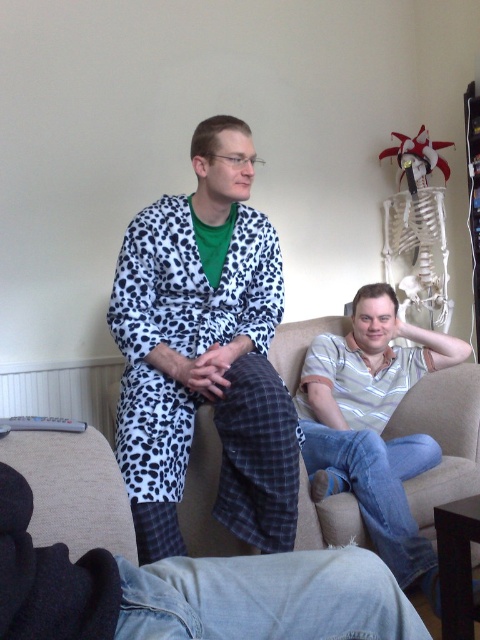
Who is positioned more to the left, white leopard print robe at left or denim pants at lower center?

Positioned to the left is white leopard print robe at left.

Between white leopard print robe at left and denim pants at lower center, which one appears on the right side from the viewer's perspective?

denim pants at lower center

At what (x,y) coordinates should I click in order to perform the action: click on white leopard print robe at left. Please return your answer as a coordinate pair (x, y). Image resolution: width=480 pixels, height=640 pixels. Looking at the image, I should click on (194, 392).

You are a GUI agent. You are given a task and a screenshot of the screen. Output one action in this format:
    pyautogui.click(x=<x>, y=<y>)
    Task: Click on the white leopard print robe at left
    
    Given the screenshot: What is the action you would take?
    pyautogui.click(x=194, y=392)

Does denim pants at lower center have a larger size compared to striped cotton shirt at center?

No.

At what (x,y) coordinates should I click in order to perform the action: click on denim pants at lower center. Please return your answer as a coordinate pair (x, y). Looking at the image, I should click on (190, 592).

Locate an element on the screen. This screenshot has width=480, height=640. denim pants at lower center is located at coordinates (190, 592).

At what (x,y) coordinates should I click in order to perform the action: click on denim pants at lower center. Please return your answer as a coordinate pair (x, y). This screenshot has width=480, height=640. Looking at the image, I should click on (190, 592).

What do you see at coordinates (194, 392) in the screenshot? I see `white leopard print robe at left` at bounding box center [194, 392].

Which is more to the left, white leopard print robe at left or striped cotton shirt at center?

From the viewer's perspective, white leopard print robe at left appears more on the left side.

In order to click on white leopard print robe at left in this screenshot , I will do `click(194, 392)`.

This screenshot has width=480, height=640. In order to click on white leopard print robe at left in this screenshot , I will do `click(194, 392)`.